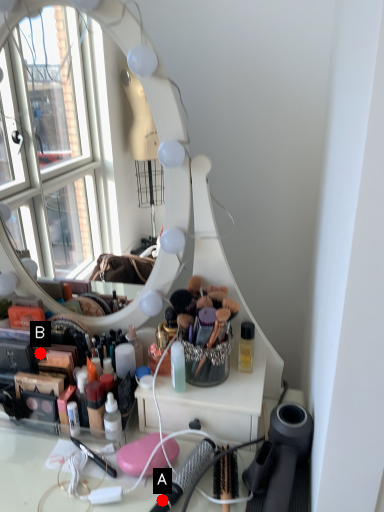
Question: Two points are circled on the image, labeled by A and B beside each circle. Which point appears farthest from the camera in this image?

Choices:
 (A) A is further
 (B) B is further

Answer: (B)